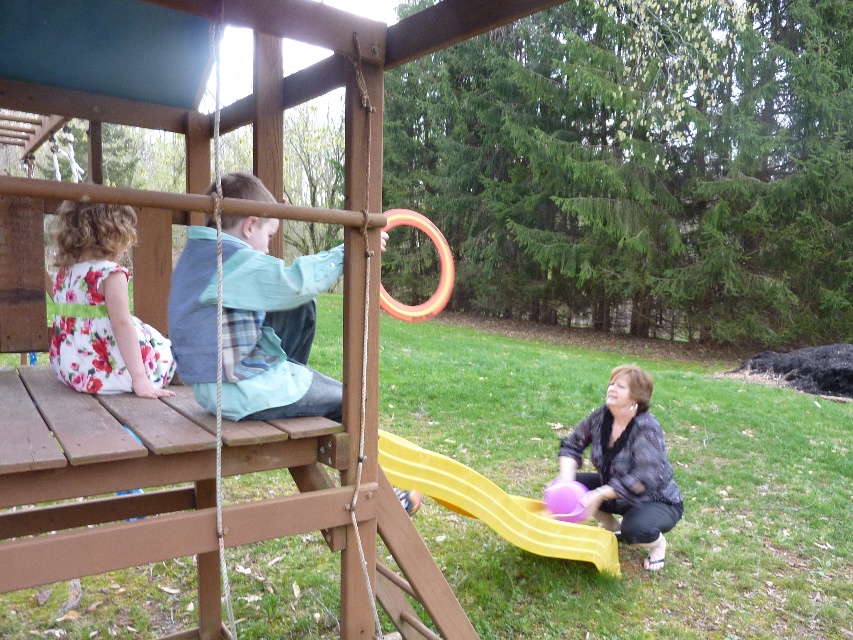
Question: Considering the relative positions of floral cotton dress at left and orange rubber ring at upper center in the image provided, where is floral cotton dress at left located with respect to orange rubber ring at upper center?

Choices:
 (A) below
 (B) above

Answer: (A)

Question: Estimate the real-world distances between objects in this image. Which object is farther from the light blue denim jacket at left?

Choices:
 (A) floral cotton dress at left
 (B) rubberized pink ball at lower center
 (C) purple matte balloon at lower right

Answer: (C)

Question: Is light blue denim jacket at left positioned at the back of rubberized pink ball at lower center?

Choices:
 (A) no
 (B) yes

Answer: (A)

Question: Which point is farther to the camera?

Choices:
 (A) (407, 470)
 (B) (125, 364)
 (C) (254, 241)
 (D) (579, 433)

Answer: (D)

Question: Is light blue denim jacket at left closer to camera compared to purple matte balloon at lower right?

Choices:
 (A) no
 (B) yes

Answer: (B)

Question: Which object is farther from the camera taking this photo?

Choices:
 (A) yellow plastic slide at lower center
 (B) rubberized pink ball at lower center
 (C) light blue denim jacket at left
 (D) purple matte balloon at lower right

Answer: (B)